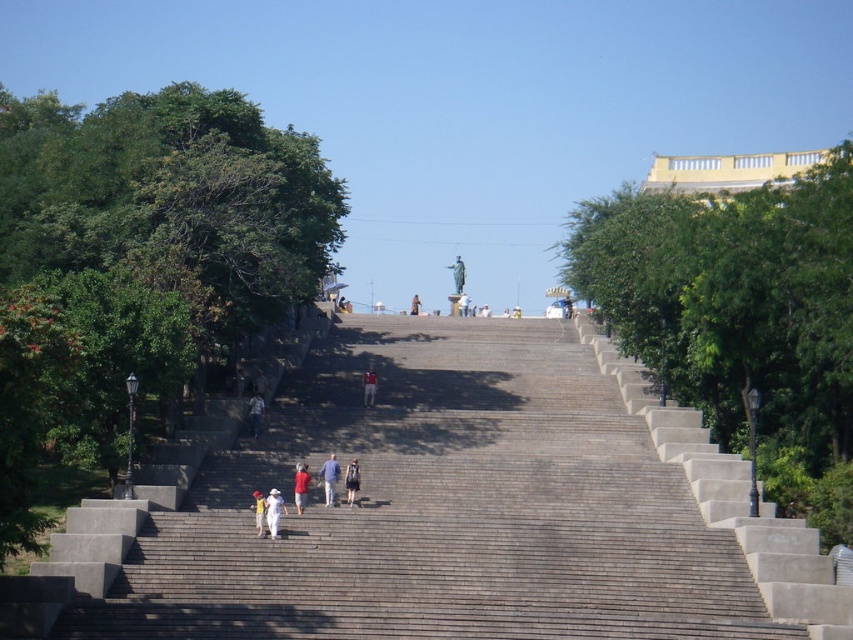
Looking at this image, you are standing at the bottom of the staircase and want to reach the statue at the top. There are two points marked on the staircase. Which point, point (762, 474) or point (338, 472), is closer to your current position?

Point (338, 472) is closer to your current position because it is closer to the bottom of the staircase than point (762, 474), which is further up towards the statue.